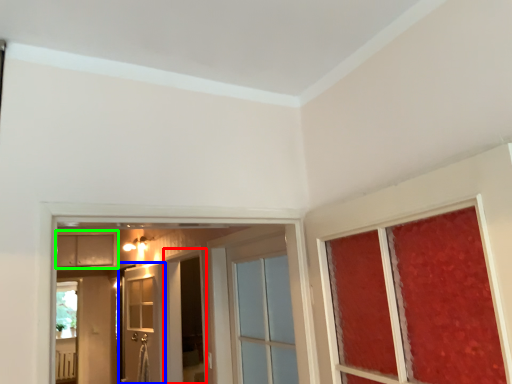
Question: Which object is the farthest from screen door (highlighted by a red box)? Choose among these: door (highlighted by a blue box) or cabinetry (highlighted by a green box).

Choices:
 (A) door
 (B) cabinetry

Answer: (B)